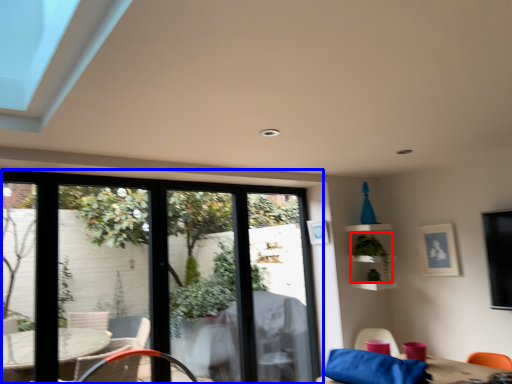
Question: Which of the following is the farthest to the observer, plant (highlighted by a red box) or window (highlighted by a blue box)?

Choices:
 (A) plant
 (B) window

Answer: (A)